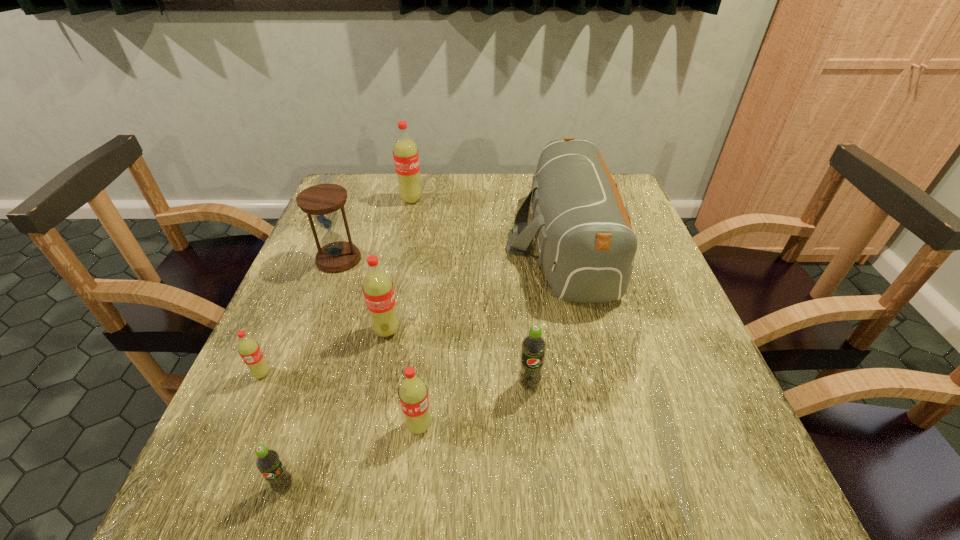
Where is `free space at the right edge of the desktop`? free space at the right edge of the desktop is located at coordinates click(x=716, y=434).

Locate an element on the screen. The height and width of the screenshot is (540, 960). vacant area at the far left corner is located at coordinates (348, 180).

You are a GUI agent. You are given a task and a screenshot of the screen. Output one action in this format:
    pyautogui.click(x=<x>, y=<y>)
    Task: Click on the vacant region between the second biggest red soda and the farthest red soda
    
    Given the screenshot: What is the action you would take?
    pyautogui.click(x=399, y=265)

The height and width of the screenshot is (540, 960). Identify the location of free point between the right green soda and the hourglass. (434, 321).

Image resolution: width=960 pixels, height=540 pixels. Find the location of `free space between the duffel bag and the biggest red soda`. free space between the duffel bag and the biggest red soda is located at coordinates (488, 221).

The width and height of the screenshot is (960, 540). Identify the location of free spot between the right green soda and the leftmost soda. (396, 379).

This screenshot has width=960, height=540. I want to click on free area in between the rightmost soda and the hourglass, so click(x=434, y=321).

Find the location of a particular element. free spot between the second nearest red soda and the second tallest soda is located at coordinates (324, 352).

Identify the location of free space between the hourglass and the rightmost soda. The width and height of the screenshot is (960, 540). (434, 321).

Find the location of a particular element. The width and height of the screenshot is (960, 540). free spot between the hourglass and the bigger green soda is located at coordinates (434, 321).